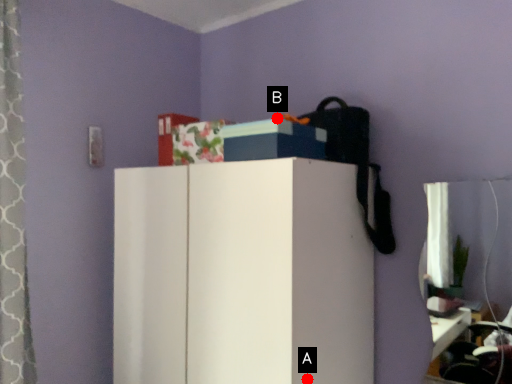
Question: Two points are circled on the image, labeled by A and B beside each circle. Which point is closer to the camera taking this photo?

Choices:
 (A) A is closer
 (B) B is closer

Answer: (A)